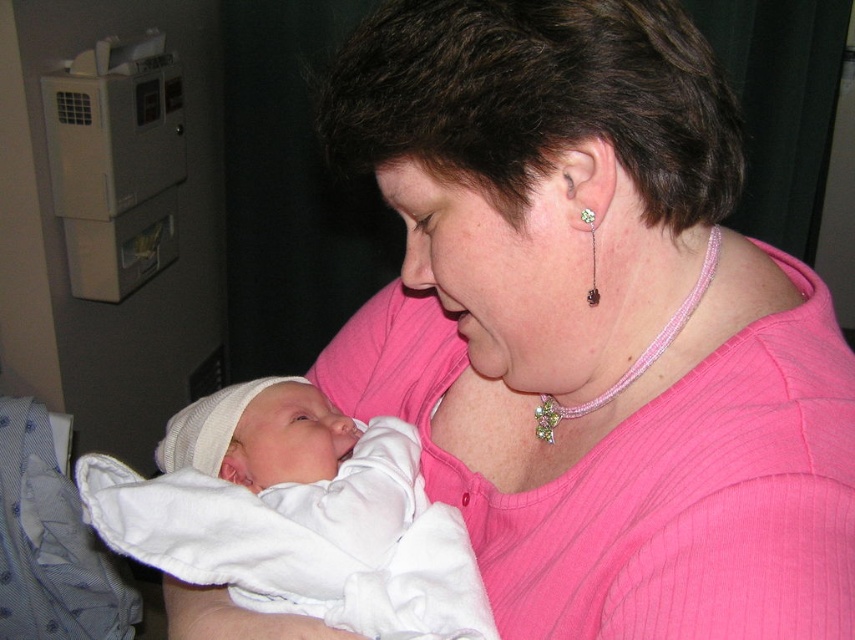
Does point (181, 456) come behind point (600, 403)?

That is True.

Is white soft cloth at center behind pink beaded necklace at center?

That is False.

Is point (463, 605) less distant than point (556, 424)?

Yes.

At what (x,y) coordinates should I click in order to perform the action: click on white soft cloth at center. Please return your answer as a coordinate pair (x, y). The width and height of the screenshot is (855, 640). Looking at the image, I should click on (339, 492).

Measure the distance from white soft cloth at center to green crystal earring at ear.

They are 10.69 inches apart.

Is white soft cloth at center wider than green crystal earring at ear?

Yes, white soft cloth at center is wider than green crystal earring at ear.

Is point (419, 630) behind point (591, 276)?

Yes, it is behind point (591, 276).

Find the location of `white soft cloth at center`. white soft cloth at center is located at coordinates (339, 492).

Is point (705, 280) farther from viewer compared to point (593, 257)?

Yes, it is behind point (593, 257).

Is point (700, 272) in front of point (587, 300)?

No, it is not.

You are a GUI agent. You are given a task and a screenshot of the screen. Output one action in this format:
    pyautogui.click(x=<x>, y=<y>)
    Task: Click on the pink beaded necklace at center
    Image resolution: width=855 pixels, height=640 pixels.
    Given the screenshot: What is the action you would take?
    pyautogui.click(x=638, y=355)